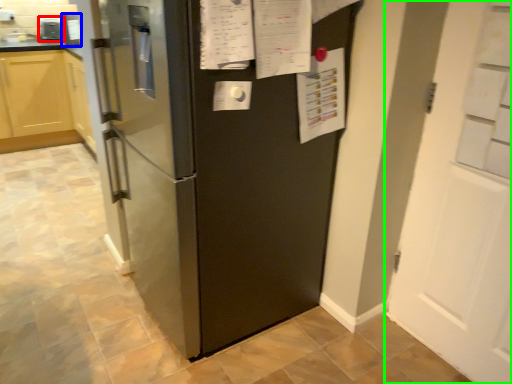
Question: Which object is the farthest from appliance (highlighted by a red box)? Choose among these: appliance (highlighted by a blue box) or door (highlighted by a green box).

Choices:
 (A) appliance
 (B) door

Answer: (B)